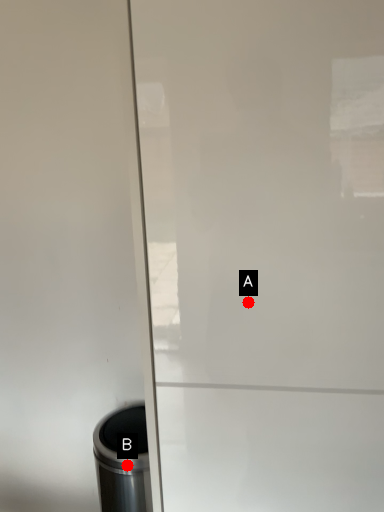
Question: Two points are circled on the image, labeled by A and B beside each circle. Which of the following is the closest to the observer?

Choices:
 (A) A is closer
 (B) B is closer

Answer: (A)